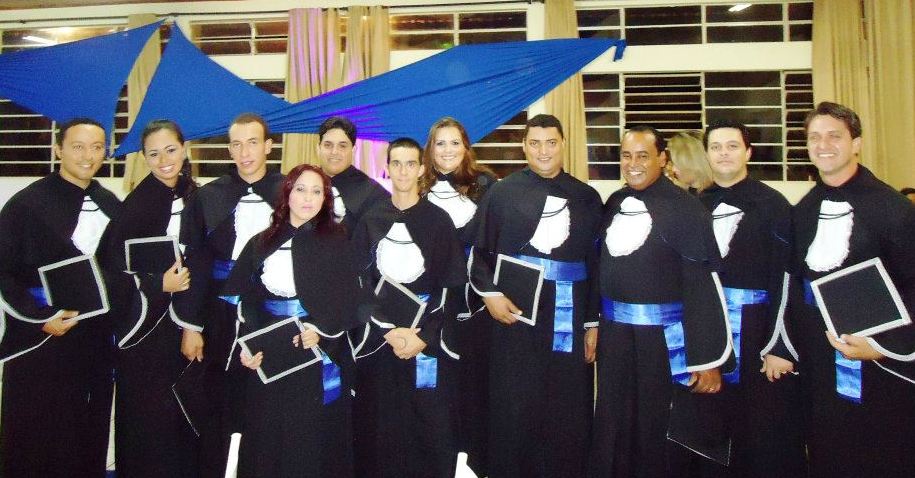
Identify the location of window. (680, 120).